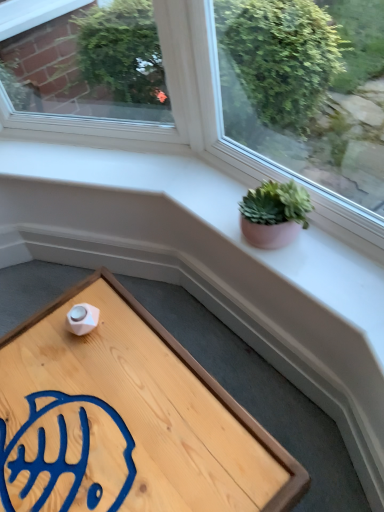
I want to click on free point above wooden tray at lower left (from a real-world perspective), so click(99, 418).